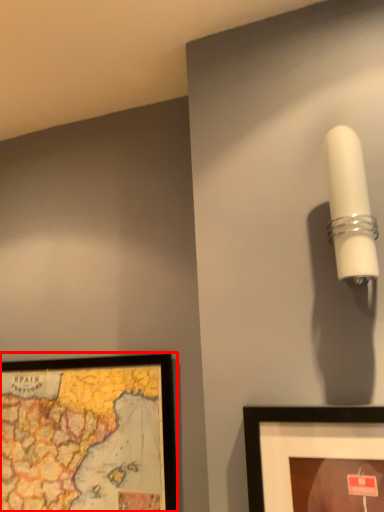
Question: From the image's perspective, where is picture frame (annotated by the red box) located relative to lamp?

Choices:
 (A) above
 (B) below

Answer: (B)